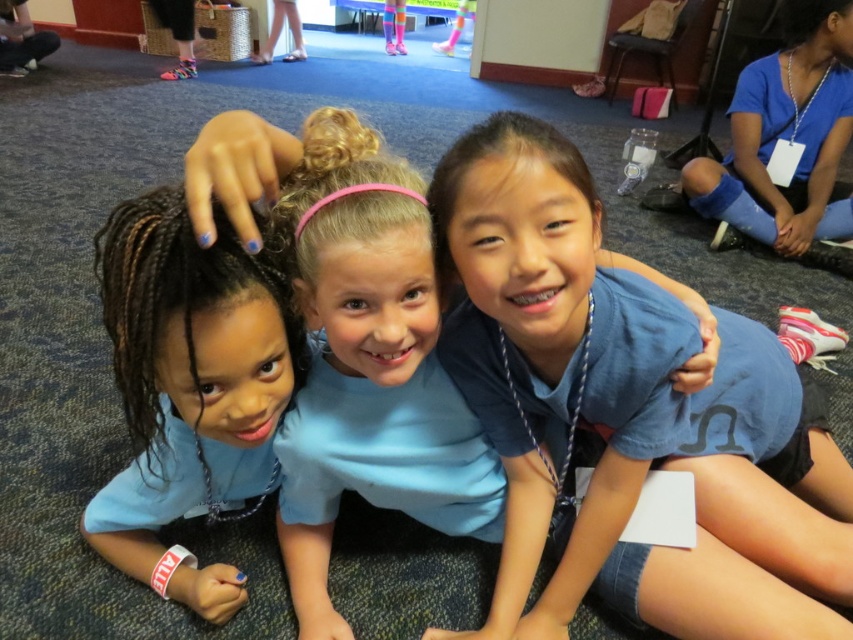
Identify the location of blue cotton shirt at center. This screenshot has height=640, width=853. (370, 371).

Who is higher up, blue cotton shirt at center or blue fabric leg at lower right?

blue fabric leg at lower right is higher up.

Is point (437, 298) closer to viewer compared to point (706, 156)?

Yes.

Identify the location of blue cotton shirt at center. (370, 371).

Does point (103, 520) lie behind point (817, 172)?

No.

Between blue matte hair at center and blue fabric leg at lower right, which one has less height?

Standing shorter between the two is blue matte hair at center.

In order to click on blue matte hair at center in this screenshot , I will do `click(189, 390)`.

Where is `blue matte hair at center`? blue matte hair at center is located at coordinates (189, 390).

Locate an element on the screen. blue cotton shirt at center is located at coordinates (370, 371).

Which is in front, point (380, 365) or point (270, 445)?

Point (380, 365) is in front.

Describe the element at coordinates (370, 371) in the screenshot. I see `blue cotton shirt at center` at that location.

This screenshot has width=853, height=640. Identify the location of blue cotton shirt at center. (370, 371).